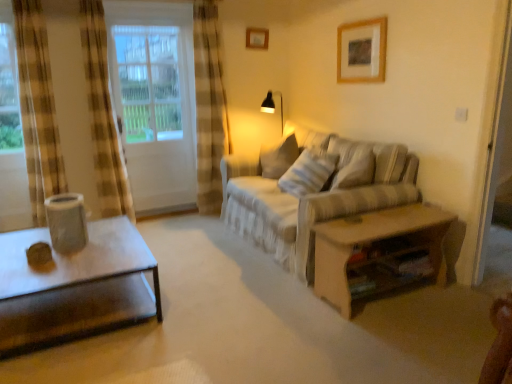
Question: Is wooden picture frame at upper center, acting as the first picture frame starting from the back, positioned with its back to white striped fabric pillow at center?

Choices:
 (A) yes
 (B) no

Answer: (B)

Question: From the image's perspective, is wooden picture frame at upper center, arranged as the first picture frame when viewed from the left, beneath white striped fabric pillow at center?

Choices:
 (A) yes
 (B) no

Answer: (B)

Question: Is wooden picture frame at upper center, acting as the first picture frame starting from the back, in front of white striped fabric pillow at center?

Choices:
 (A) yes
 (B) no

Answer: (B)

Question: Is wooden picture frame at upper center, which ranks as the 1th picture frame in top-to-bottom order, far from white striped fabric pillow at center?

Choices:
 (A) no
 (B) yes

Answer: (B)

Question: Does wooden picture frame at upper center, the 2th picture frame in the bottom-to-top sequence, have a greater height compared to white striped fabric pillow at center?

Choices:
 (A) yes
 (B) no

Answer: (B)

Question: In terms of width, does matte plastic speaker at left look wider or thinner when compared to wooden picture frame at upper center, the first picture frame in the front-to-back sequence?

Choices:
 (A) thin
 (B) wide

Answer: (B)

Question: From a real-world perspective, is matte plastic speaker at left positioned above or below wooden picture frame at upper center, which is the first picture frame from right to left?

Choices:
 (A) below
 (B) above

Answer: (A)

Question: Considering their positions, is matte plastic speaker at left located in front of or behind wooden picture frame at upper center, the second picture frame from the left?

Choices:
 (A) behind
 (B) front

Answer: (B)

Question: Looking at the image, does matte plastic speaker at left seem bigger or smaller compared to wooden picture frame at upper center, which is the first picture frame from right to left?

Choices:
 (A) big
 (B) small

Answer: (A)

Question: Considering the positions of white striped fabric pillow at center and wooden table at right in the image, is white striped fabric pillow at center taller or shorter than wooden table at right?

Choices:
 (A) tall
 (B) short

Answer: (A)

Question: Is point (290, 172) positioned closer to the camera than point (390, 233)?

Choices:
 (A) closer
 (B) farther

Answer: (B)

Question: In terms of width, does white striped fabric pillow at center look wider or thinner when compared to wooden table at right?

Choices:
 (A) thin
 (B) wide

Answer: (A)

Question: From the image's perspective, is white striped fabric pillow at center located above or below wooden table at right?

Choices:
 (A) below
 (B) above

Answer: (B)

Question: In terms of width, does wooden table at right look wider or thinner when compared to wooden picture frame at upper center, positioned as the 2th picture frame in top-to-bottom order?

Choices:
 (A) wide
 (B) thin

Answer: (A)

Question: In terms of height, does wooden table at right look taller or shorter compared to wooden picture frame at upper center, the second picture frame from the left?

Choices:
 (A) short
 (B) tall

Answer: (B)